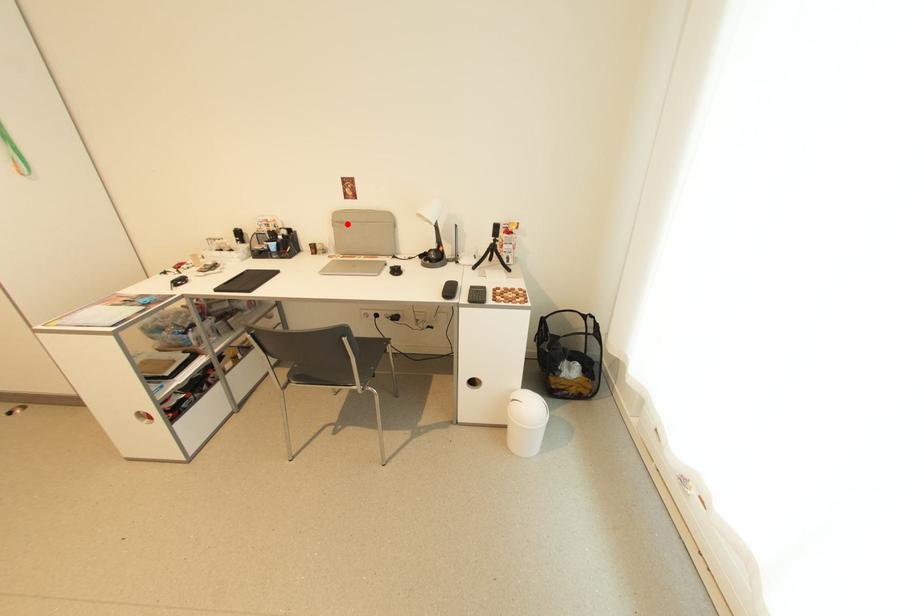
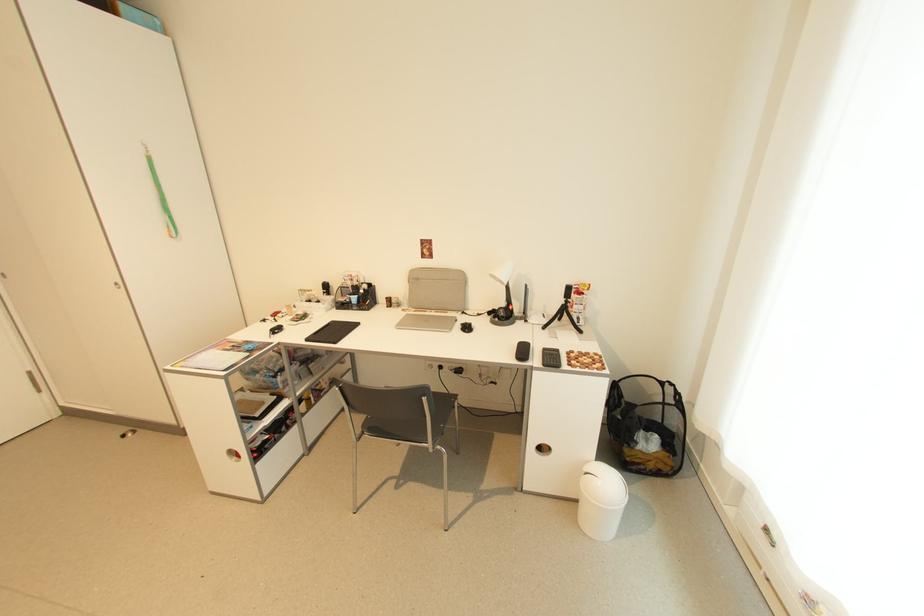
Question: I am providing you with two images of the same scene from different viewpoints. In image1, a red point is highlighted. Considering the same 3D point in image2, which of the following is correct?

Choices:
 (A) It is closer
 (B) It is farther

Answer: (B)